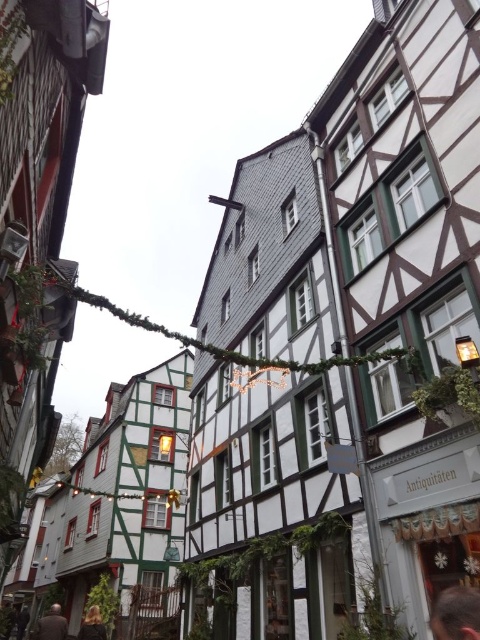
Question: Can you confirm if blonde hair at lower left is positioned to the left of dark brown leather jacket at lower left?

Choices:
 (A) no
 (B) yes

Answer: (A)

Question: Which point is farther to the camera?

Choices:
 (A) (15, 621)
 (B) (7, 627)

Answer: (A)

Question: Does blonde hair at lower left have a smaller size compared to dark brown leather jacket at lower left?

Choices:
 (A) no
 (B) yes

Answer: (A)

Question: Which point appears farthest from the camera in this image?

Choices:
 (A) (447, 602)
 (B) (20, 612)
 (C) (64, 636)
 (D) (95, 609)

Answer: (B)

Question: Does dark brown hair at lower left have a larger size compared to dark brown leather jacket at lower left?

Choices:
 (A) yes
 (B) no

Answer: (A)

Question: Which is farther from the dark brown leather jacket at lower left?

Choices:
 (A) dark brown hair at lower right
 (B) dark brown hair at lower left
 (C) blonde hair at lower left

Answer: (A)